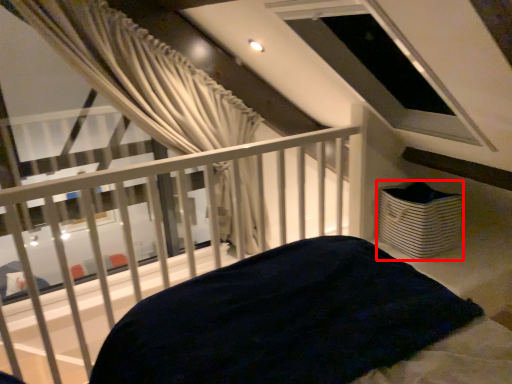
Question: From the image's perspective, what is the correct spatial relationship of basket (annotated by the red box) in relation to balcony?

Choices:
 (A) above
 (B) below

Answer: (A)